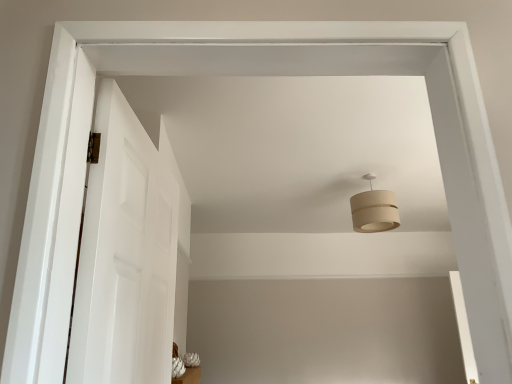
Question: Is white smooth door at left further to camera compared to white glossy vase at lower center?

Choices:
 (A) no
 (B) yes

Answer: (A)

Question: Considering the relative positions of white smooth door at left and white glossy vase at lower center in the image provided, is white smooth door at left to the left of white glossy vase at lower center from the viewer's perspective?

Choices:
 (A) no
 (B) yes

Answer: (A)

Question: Can you confirm if white smooth door at left is taller than white glossy vase at lower center?

Choices:
 (A) yes
 (B) no

Answer: (A)

Question: From the image's perspective, would you say white smooth door at left is shown under white glossy vase at lower center?

Choices:
 (A) no
 (B) yes

Answer: (A)

Question: Is white smooth door at left facing away from white glossy vase at lower center?

Choices:
 (A) no
 (B) yes

Answer: (A)

Question: From a real-world perspective, is white glossy vase at lower center above or below beige fabric lampshade at upper center?

Choices:
 (A) below
 (B) above

Answer: (A)

Question: Considering the positions of white glossy vase at lower center and beige fabric lampshade at upper center in the image, is white glossy vase at lower center wider or thinner than beige fabric lampshade at upper center?

Choices:
 (A) wide
 (B) thin

Answer: (B)

Question: Does point (196, 377) appear closer or farther from the camera than point (368, 208)?

Choices:
 (A) farther
 (B) closer

Answer: (A)

Question: In terms of height, does white glossy vase at lower center look taller or shorter compared to beige fabric lampshade at upper center?

Choices:
 (A) short
 (B) tall

Answer: (A)

Question: From the image's perspective, relative to white smooth door at left, is white glossy vase at lower center above or below?

Choices:
 (A) below
 (B) above

Answer: (A)

Question: Considering the positions of white glossy vase at lower center and white smooth door at left in the image, is white glossy vase at lower center bigger or smaller than white smooth door at left?

Choices:
 (A) big
 (B) small

Answer: (B)

Question: From a real-world perspective, is white glossy vase at lower center above or below white smooth door at left?

Choices:
 (A) above
 (B) below

Answer: (B)

Question: Is white glossy vase at lower center in front of or behind white smooth door at left in the image?

Choices:
 (A) front
 (B) behind

Answer: (B)

Question: In terms of height, does white smooth door at left look taller or shorter compared to white glossy vase at lower center?

Choices:
 (A) short
 (B) tall

Answer: (B)

Question: From a real-world perspective, is white smooth door at left physically located above or below white glossy vase at lower center?

Choices:
 (A) below
 (B) above

Answer: (B)